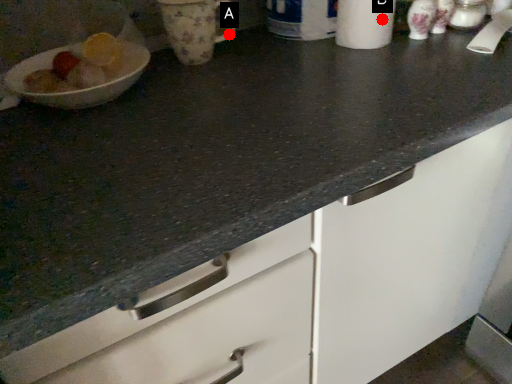
Question: Two points are circled on the image, labeled by A and B beside each circle. Which point is closer to the camera?

Choices:
 (A) A is closer
 (B) B is closer

Answer: (B)